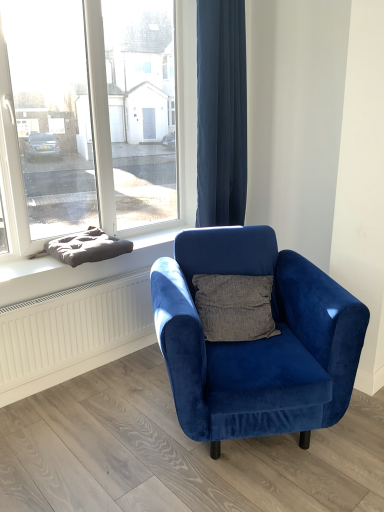
Question: Should I look upward or downward to see velvet blue armchair at center?

Choices:
 (A) down
 (B) up

Answer: (A)

Question: Is white textured radiator at lower left at the back of transparent glass window at upper left?

Choices:
 (A) no
 (B) yes

Answer: (A)

Question: Would you say transparent glass window at upper left is a long distance from white textured radiator at lower left?

Choices:
 (A) yes
 (B) no

Answer: (B)

Question: Is transparent glass window at upper left at the right side of white textured radiator at lower left?

Choices:
 (A) no
 (B) yes

Answer: (B)

Question: Does transparent glass window at upper left lie in front of white textured radiator at lower left?

Choices:
 (A) yes
 (B) no

Answer: (A)

Question: Is transparent glass window at upper left to the left of white textured radiator at lower left from the viewer's perspective?

Choices:
 (A) no
 (B) yes

Answer: (A)

Question: Is the position of transparent glass window at upper left more distant than that of white textured radiator at lower left?

Choices:
 (A) yes
 (B) no

Answer: (B)

Question: Does white textured radiator at lower left have a smaller size compared to transparent glass window at upper left?

Choices:
 (A) yes
 (B) no

Answer: (A)

Question: Is the position of white textured radiator at lower left more distant than that of transparent glass window at upper left?

Choices:
 (A) no
 (B) yes

Answer: (B)

Question: From a real-world perspective, is white textured radiator at lower left on top of transparent glass window at upper left?

Choices:
 (A) yes
 (B) no

Answer: (B)

Question: Is transparent glass window at upper left located within white textured radiator at lower left?

Choices:
 (A) no
 (B) yes

Answer: (A)

Question: Is white textured radiator at lower left placed right next to transparent glass window at upper left?

Choices:
 (A) no
 (B) yes

Answer: (A)

Question: Is white textured radiator at lower left shorter than transparent glass window at upper left?

Choices:
 (A) yes
 (B) no

Answer: (A)

Question: Does velvet blue armchair at center lie in front of transparent glass window at upper left?

Choices:
 (A) no
 (B) yes

Answer: (B)